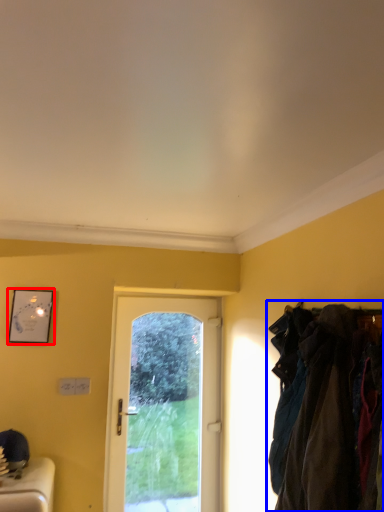
Question: Which of the following is the farthest to the observer, picture frame (highlighted by a red box) or laundry (highlighted by a blue box)?

Choices:
 (A) picture frame
 (B) laundry

Answer: (A)